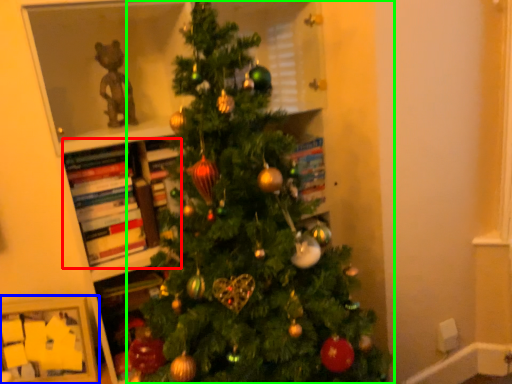
Question: Which object is the closest to the book (highlighted by a red box)? Choose among these: picture frame (highlighted by a blue box) or christmas tree (highlighted by a green box).

Choices:
 (A) picture frame
 (B) christmas tree

Answer: (A)